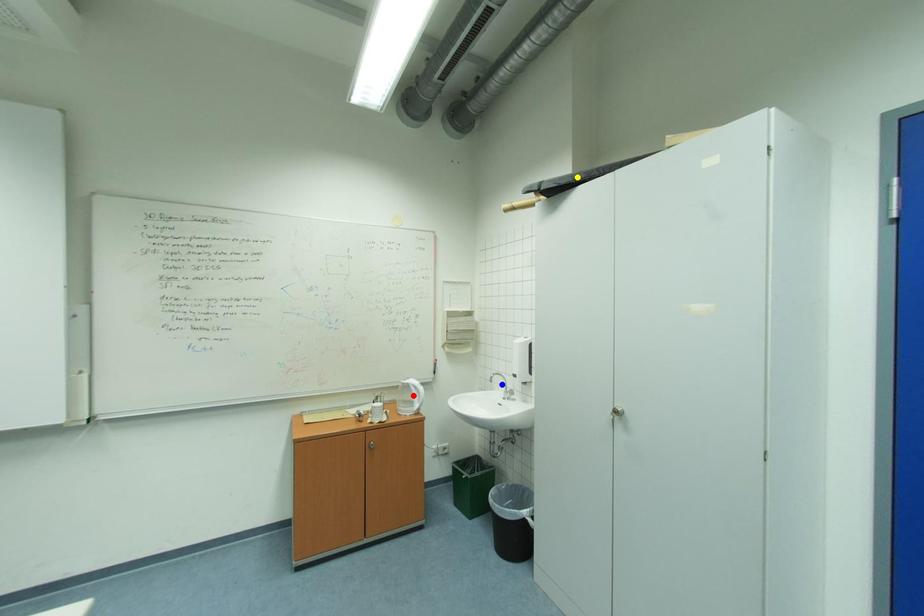
Order these from nearest to farthest:
red point, yellow point, blue point

1. yellow point
2. blue point
3. red point